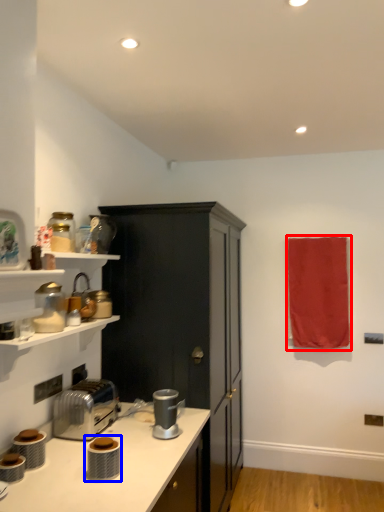
Question: Which point is further to the camera, beach towel (highlighted by a red box) or appliance (highlighted by a blue box)?

Choices:
 (A) beach towel
 (B) appliance

Answer: (A)